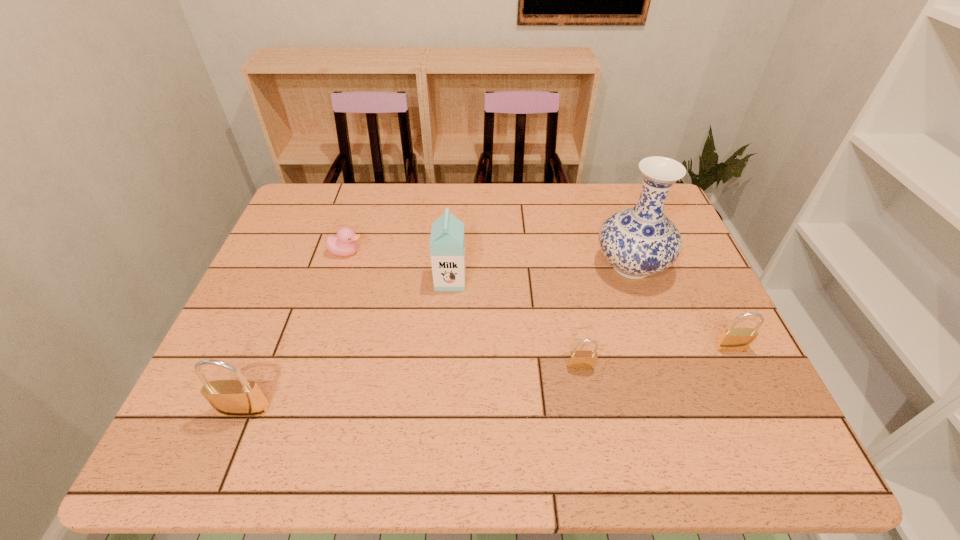
Find the location of a particular element. Image resolution: width=960 pixels, height=540 pixels. empty location between the second nearest padlock and the leftmost object is located at coordinates (413, 388).

At what (x,y) coordinates should I click in order to perform the action: click on free space between the second object from right to left and the leftmost object. Please return your answer as a coordinate pair (x, y). Looking at the image, I should click on (438, 338).

Locate an element on the screen. The width and height of the screenshot is (960, 540). vacant area between the fifth object from right to left and the fourth object from left to right is located at coordinates (464, 309).

Image resolution: width=960 pixels, height=540 pixels. In order to click on vacant point located between the fifth object from right to left and the nearest object in this screenshot , I will do `click(296, 330)`.

What are the coordinates of `free area in between the tallest object and the second farthest padlock` in the screenshot? It's located at (606, 316).

What are the coordinates of `vacant area that lies between the second padlock from left to right and the nearest padlock` in the screenshot? It's located at (413, 388).

Where is `free point between the tallest object and the fourth object from left to right`? free point between the tallest object and the fourth object from left to right is located at coordinates (606, 316).

Locate an element on the screen. This screenshot has width=960, height=540. free point between the fifth object from left to right and the fifth object from right to left is located at coordinates (489, 259).

Locate an element on the screen. This screenshot has width=960, height=540. the second closest object relative to the fourth farthest object is located at coordinates (578, 360).

Locate an element on the screen. object that ranks as the second closest to the fifth object from right to left is located at coordinates pos(241,397).